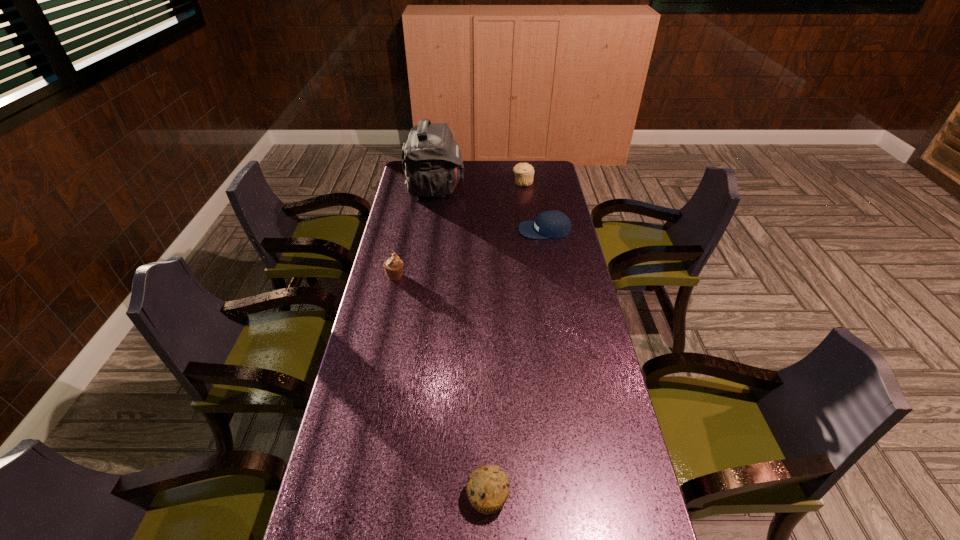
Where is `vacant space that satisfies the following two spatial constraints: 1. on the open flap of the tallest object; 2. on the right side of the nearest muffin`? This screenshot has height=540, width=960. vacant space that satisfies the following two spatial constraints: 1. on the open flap of the tallest object; 2. on the right side of the nearest muffin is located at coordinates (390, 496).

Locate an element on the screen. This screenshot has width=960, height=540. free space that satisfies the following two spatial constraints: 1. on the open flap of the second muffin from left to right; 2. on the right side of the tallest object is located at coordinates (390, 496).

Identify the location of blank area in the image that satisfies the following two spatial constraints: 1. on the front side of the farthest muffin; 2. on the open flap of the shoulder bag. (523, 189).

The height and width of the screenshot is (540, 960). Find the location of `vacant space that satisfies the following two spatial constraints: 1. on the front side of the farthest muffin; 2. on the open flap of the tallest object`. vacant space that satisfies the following two spatial constraints: 1. on the front side of the farthest muffin; 2. on the open flap of the tallest object is located at coordinates (523, 189).